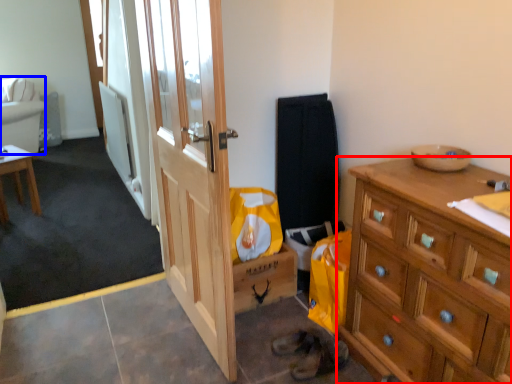
Question: Which object is closer to the camera taking this photo, cabinetry (highlighted by a red box) or studio couch (highlighted by a blue box)?

Choices:
 (A) cabinetry
 (B) studio couch

Answer: (A)